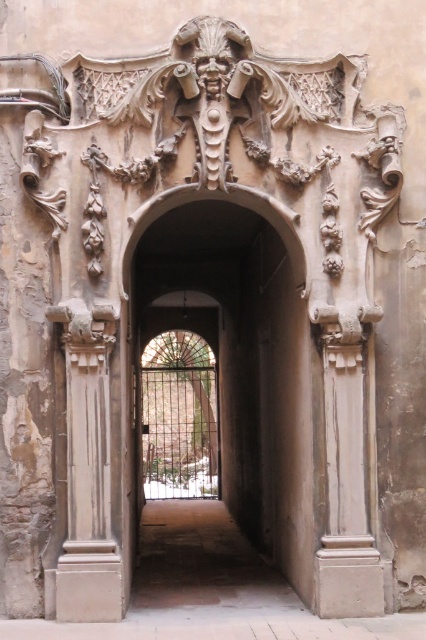
You are standing in front of the doorway and want to walk through the smooth stone archway at center. Based on its position, where should you aim to step to enter the doorway?

The smooth stone archway at center is positioned at point [242,364], so you should aim to step towards the center of the doorway to enter through the smooth stone archway at center.

In the scene shown: You are standing in front of the ornate doorway and want to touch both points marked on the archway. Which point should you reach for first, the one at point coordinates [170,284] or the one at [356,460]?

You should reach for the point at coordinates [170,284] first because it is closer to you than the point at [356,460], which is further away.

You are standing in front of the doorway and want to take a photo of the beige stone column at left. Where should you look to capture it in your camera?

The beige stone column at left is located at point [88,474], so you should aim your camera towards that coordinate to capture it.